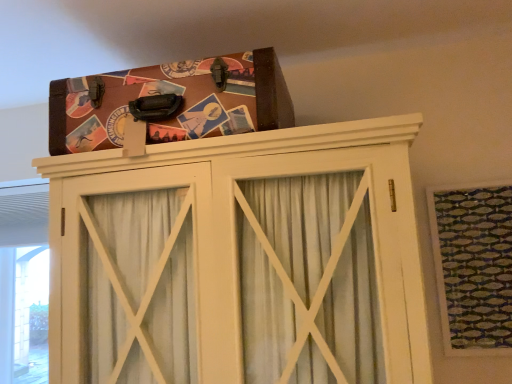
In order to click on green textured fabric at upper right in this screenshot , I will do `click(473, 267)`.

The image size is (512, 384). Describe the element at coordinates (234, 230) in the screenshot. I see `wooden cabinet at upper center` at that location.

Locate an element on the screen. The width and height of the screenshot is (512, 384). brown leather suitcase at upper center is located at coordinates (170, 102).

At what (x,y) coordinates should I click in order to perform the action: click on green textured fabric at upper right. Please return your answer as a coordinate pair (x, y). This screenshot has height=384, width=512. Looking at the image, I should click on (473, 267).

At what (x,y) coordinates should I click in order to perform the action: click on window located on the right of brown leather suitcase at upper center. Please return your answer as a coordinate pair (x, y). The height and width of the screenshot is (384, 512). Looking at the image, I should click on (473, 267).

Is green textured fabric at upper right oriented away from brown leather suitcase at upper center?

No, green textured fabric at upper right's orientation is not away from brown leather suitcase at upper center.

Considering the points (502, 275) and (71, 105), which point is behind, point (502, 275) or point (71, 105)?

The point (502, 275) is more distant.

Measure the distance between green textured fabric at upper right and brown leather suitcase at upper center.

36.65 inches.

This screenshot has width=512, height=384. There is a wooden cabinet at upper center. What are the coordinates of `package above it (from a real-world perspective)` in the screenshot? It's located at (170, 102).

Does wooden cabinet at upper center have a lesser width compared to brown leather suitcase at upper center?

No.

Based on the photo, are wooden cabinet at upper center and brown leather suitcase at upper center making contact?

No, wooden cabinet at upper center is not making contact with brown leather suitcase at upper center.

Choose the correct answer: Is wooden cabinet at upper center inside brown leather suitcase at upper center or outside it?

wooden cabinet at upper center is not enclosed by brown leather suitcase at upper center.

Considering the points (237, 64) and (472, 229), which point is behind, point (237, 64) or point (472, 229)?

Positioned behind is point (472, 229).

Is brown leather suitcase at upper center taller than green textured fabric at upper right?

No, brown leather suitcase at upper center is not taller than green textured fabric at upper right.

From the image's perspective, which object appears higher, brown leather suitcase at upper center or green textured fabric at upper right?

brown leather suitcase at upper center, from the image's perspective.

Who is more distant, brown leather suitcase at upper center or green textured fabric at upper right?

green textured fabric at upper right is behind.

From a real-world perspective, is green textured fabric at upper right below wooden cabinet at upper center?

Correct, in the physical world, green textured fabric at upper right is lower than wooden cabinet at upper center.

Can you tell me how much green textured fabric at upper right and wooden cabinet at upper center differ in facing direction?

0.754 degrees.

Could you tell me if green textured fabric at upper right is turned towards wooden cabinet at upper center?

No, green textured fabric at upper right is not facing towards wooden cabinet at upper center.

Can you confirm if green textured fabric at upper right is wider than wooden cabinet at upper center?

In fact, green textured fabric at upper right might be narrower than wooden cabinet at upper center.

Which is more to the right, wooden cabinet at upper center or green textured fabric at upper right?

From the viewer's perspective, green textured fabric at upper right appears more on the right side.

Locate an element on the screen. cupboard lying below the green textured fabric at upper right (from the image's perspective) is located at coordinates (234, 230).

Measure the distance from wooden cabinet at upper center to green textured fabric at upper right.

wooden cabinet at upper center is 29.13 inches away from green textured fabric at upper right.

In terms of size, does wooden cabinet at upper center appear bigger or smaller than green textured fabric at upper right?

wooden cabinet at upper center is bigger than green textured fabric at upper right.

Is brown leather suitcase at upper center not close to wooden cabinet at upper center?

Actually, brown leather suitcase at upper center and wooden cabinet at upper center are a little close together.

How different are the orientations of brown leather suitcase at upper center and wooden cabinet at upper center in degrees?

The angular difference between brown leather suitcase at upper center and wooden cabinet at upper center is 0.000994 degrees.

From the picture: Between brown leather suitcase at upper center and wooden cabinet at upper center, which one appears on the right side from the viewer's perspective?

wooden cabinet at upper center.

You are a GUI agent. You are given a task and a screenshot of the screen. Output one action in this format:
    pyautogui.click(x=<x>, y=<y>)
    Task: Click on the window on the right of brown leather suitcase at upper center
    
    Given the screenshot: What is the action you would take?
    pyautogui.click(x=473, y=267)

Locate an element on the screen. The width and height of the screenshot is (512, 384). package above the wooden cabinet at upper center (from a real-world perspective) is located at coordinates (170, 102).

Estimate the real-world distances between objects in this image. Which object is further from brown leather suitcase at upper center, wooden cabinet at upper center or green textured fabric at upper right?

The object further to brown leather suitcase at upper center is green textured fabric at upper right.

Looking at the image, which one is located further to brown leather suitcase at upper center, green textured fabric at upper right or wooden cabinet at upper center?

green textured fabric at upper right is positioned further to the anchor brown leather suitcase at upper center.

Looking at this image, based on their spatial positions, is brown leather suitcase at upper center or wooden cabinet at upper center closer to green textured fabric at upper right?

Among the two, wooden cabinet at upper center is located nearer to green textured fabric at upper right.

Estimate the real-world distances between objects in this image. Which object is closer to wooden cabinet at upper center, green textured fabric at upper right or brown leather suitcase at upper center?

The object closer to wooden cabinet at upper center is brown leather suitcase at upper center.

Based on their spatial positions, is wooden cabinet at upper center or brown leather suitcase at upper center further from green textured fabric at upper right?

brown leather suitcase at upper center is further to green textured fabric at upper right.

Which object lies nearer to the anchor point wooden cabinet at upper center, brown leather suitcase at upper center or green textured fabric at upper right?

brown leather suitcase at upper center.

Locate an element on the screen. cupboard between brown leather suitcase at upper center and green textured fabric at upper right from left to right is located at coordinates (234, 230).